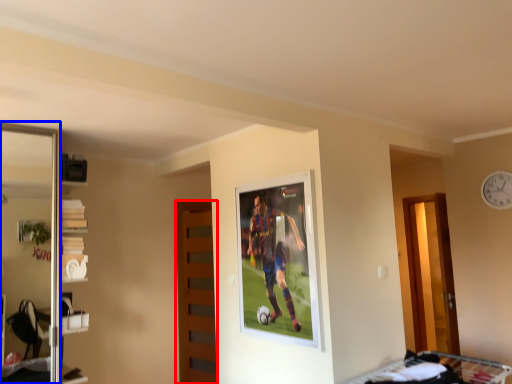
Question: Which of the following is the closest to the observer, door (highlighted by a red box) or screen door (highlighted by a blue box)?

Choices:
 (A) door
 (B) screen door

Answer: (B)